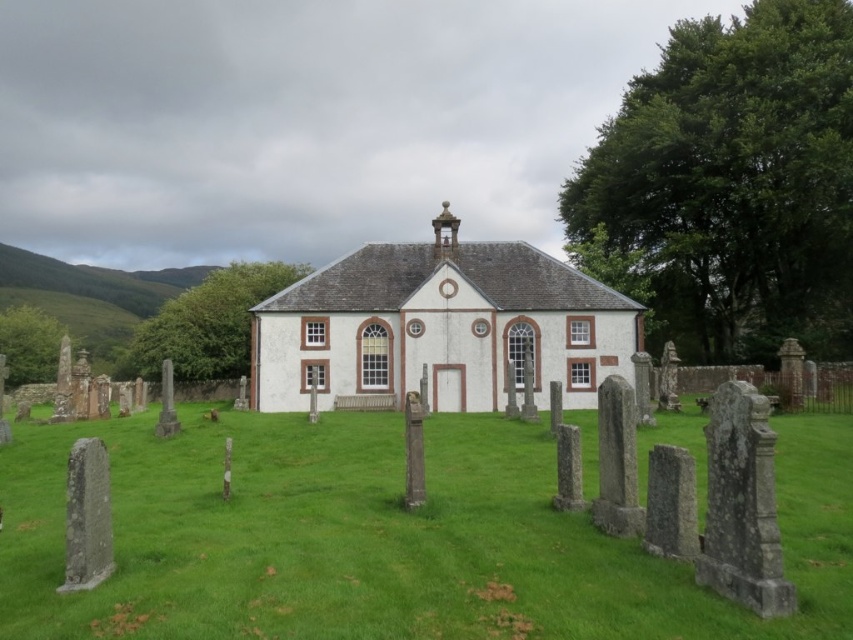
You are standing in a rural area and see the green grass at center and the white painted wood church at center. Which object is positioned lower in the image?

The green grass at center is positioned below the white painted wood church at center, so it is lower in the image.

You are standing at the entrance of the small white building with red brown trim and looking towards the bell tower. Where is the green grass at center located relative to your position?

The green grass at center is located at point (387, 538) relative to your position.

You are planning to place a new gravestone in the cemetery. The gravestone is 1 meter wide. You see the green grass at center and the white painted wood church at center. Can the gravestone fit between them without touching either?

The green grass at center might be wider than white painted wood church at center, but since the exact distance isn not provided, it is uncertain if the 1 meter wide gravestone can fit between them without touching either.